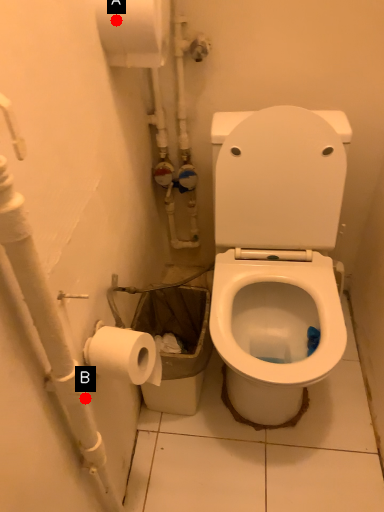
Question: Two points are circled on the image, labeled by A and B beside each circle. Which of the following is the farthest from the observer?

Choices:
 (A) A is further
 (B) B is further

Answer: (A)